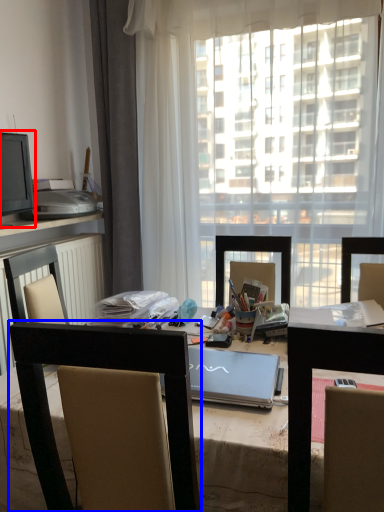
Question: Which of the following is the farthest to the observer, computer monitor (highlighted by a red box) or chair (highlighted by a blue box)?

Choices:
 (A) computer monitor
 (B) chair

Answer: (A)